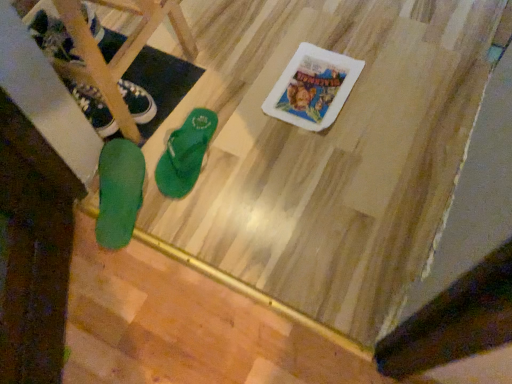
Find the location of a particular element. The width and height of the screenshot is (512, 384). free space to the right of green rubber flip-flop at lower left, the second footwear when ordered from right to left is located at coordinates coord(198,201).